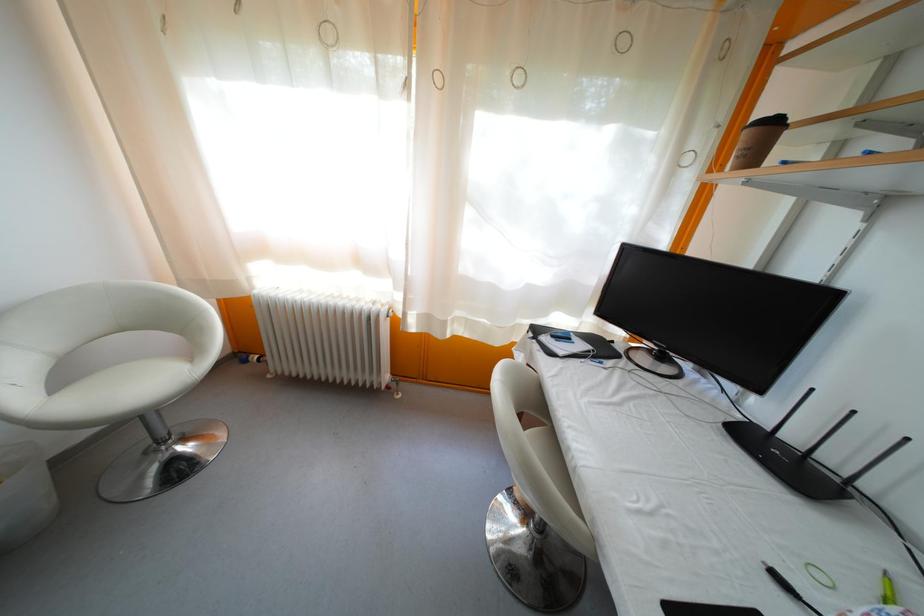
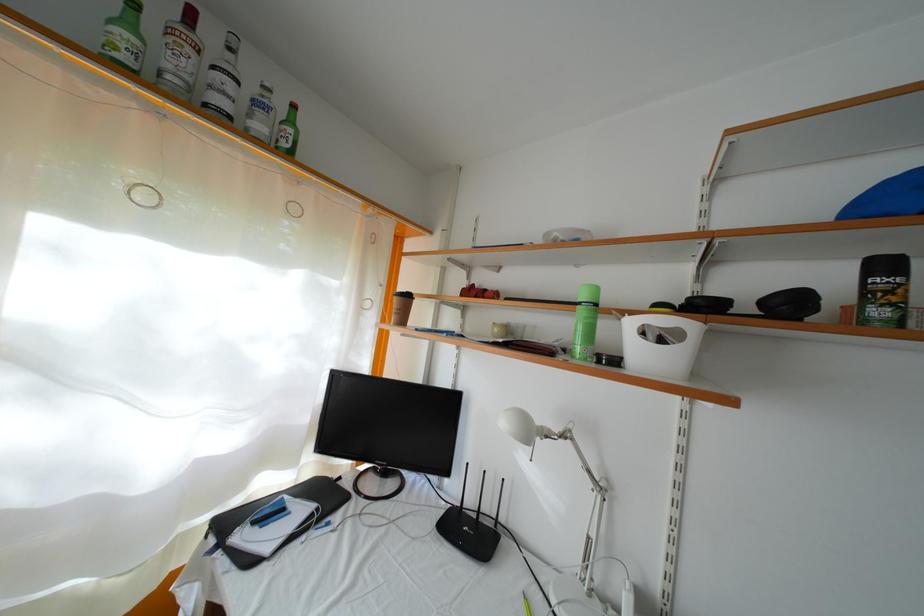
Where in the second image is the point corresponding to (x=608, y=355) from the first image?

(334, 506)